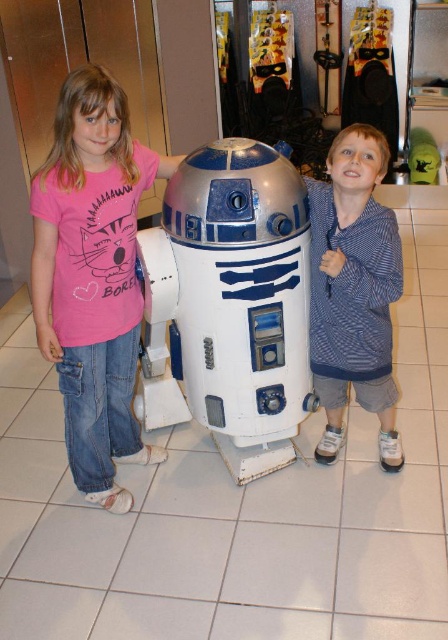
Does silver metallic robot at center have a greater width compared to pink cotton t-shirt at left?

Yes.

Which of these two, silver metallic robot at center or pink cotton t-shirt at left, stands taller?

Standing taller between the two is pink cotton t-shirt at left.

Which is in front, point (263, 378) or point (112, 93)?

Positioned in front is point (112, 93).

Identify the location of silver metallic robot at center. (229, 305).

Is silver metallic robot at center closer to camera compared to blue striped hoodie at center?

That is True.

Is point (279, 362) closer to viewer compared to point (344, 387)?

That is True.

You are a GUI agent. You are given a task and a screenshot of the screen. Output one action in this format:
    pyautogui.click(x=<x>, y=<y>)
    Task: Click on the silver metallic robot at center
    
    Given the screenshot: What is the action you would take?
    pyautogui.click(x=229, y=305)

Is pink cotton t-shirt at left bigger than blue striped hoodie at center?

Yes, pink cotton t-shirt at left is bigger than blue striped hoodie at center.

Can you confirm if pink cotton t-shirt at left is thinner than blue striped hoodie at center?

No.

This screenshot has height=640, width=448. I want to click on pink cotton t-shirt at left, so click(93, 276).

Identify the location of pink cotton t-shirt at left. The width and height of the screenshot is (448, 640). pyautogui.click(x=93, y=276).